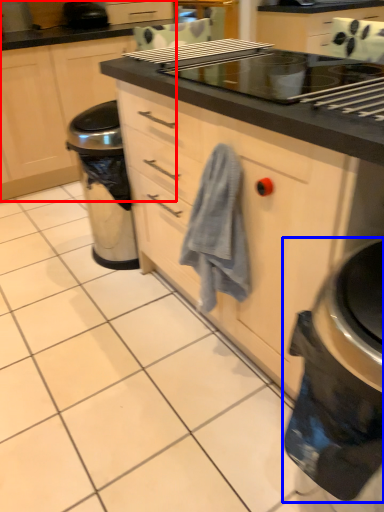
Question: Which point is closer to the camera, cabinetry (highlighted by a red box) or home appliance (highlighted by a blue box)?

Choices:
 (A) cabinetry
 (B) home appliance

Answer: (B)